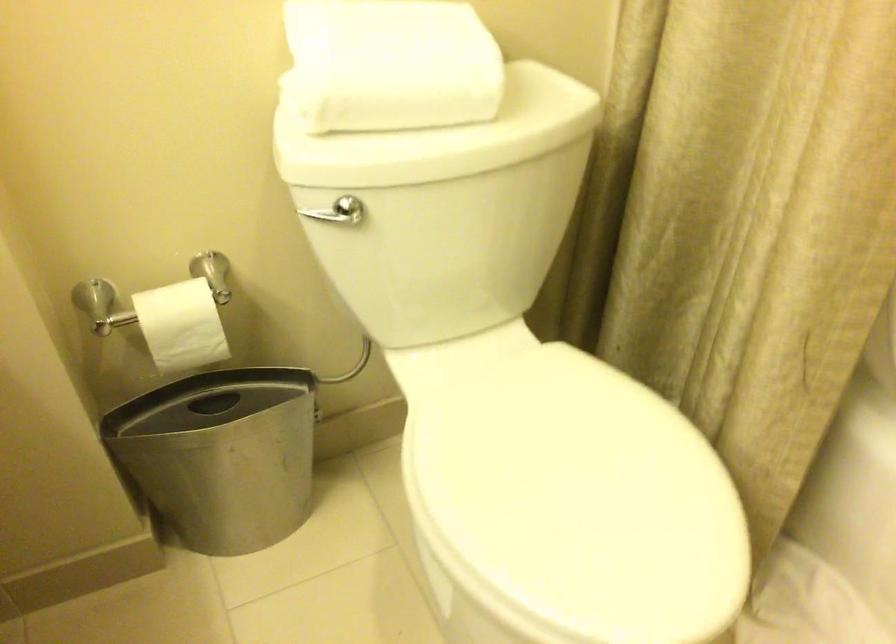
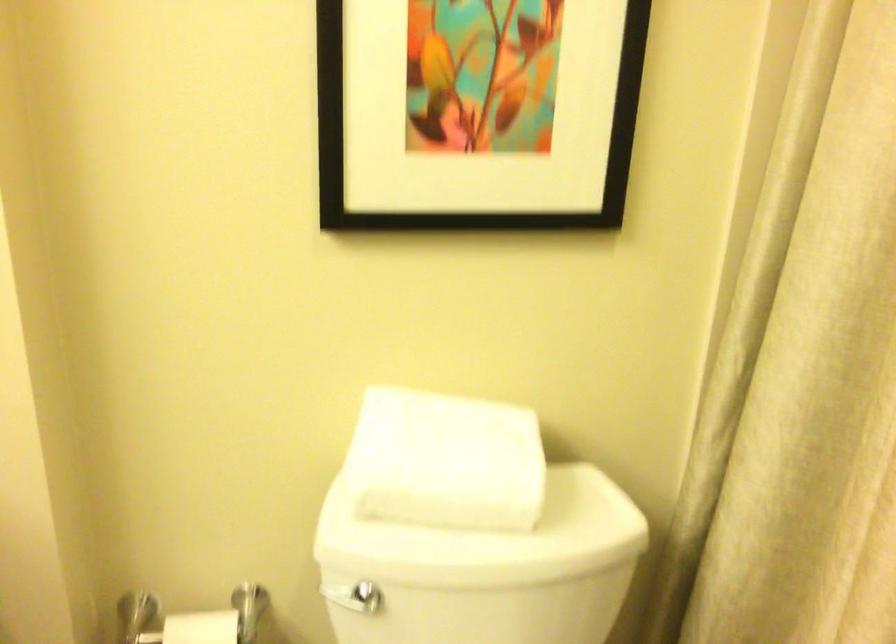
Locate, in the second image, the point that corresponds to the point at 171,292 in the first image.

(201, 627)